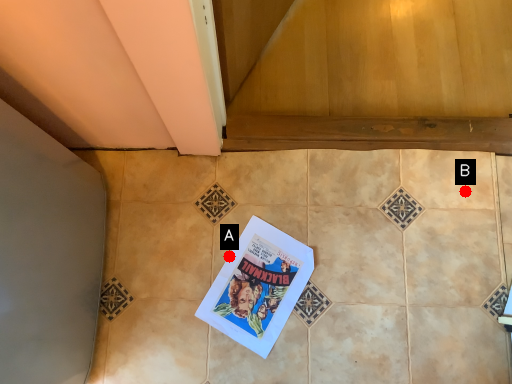
Question: Two points are circled on the image, labeled by A and B beside each circle. Among these points, which one is nearest to the camera?

Choices:
 (A) A is closer
 (B) B is closer

Answer: (A)